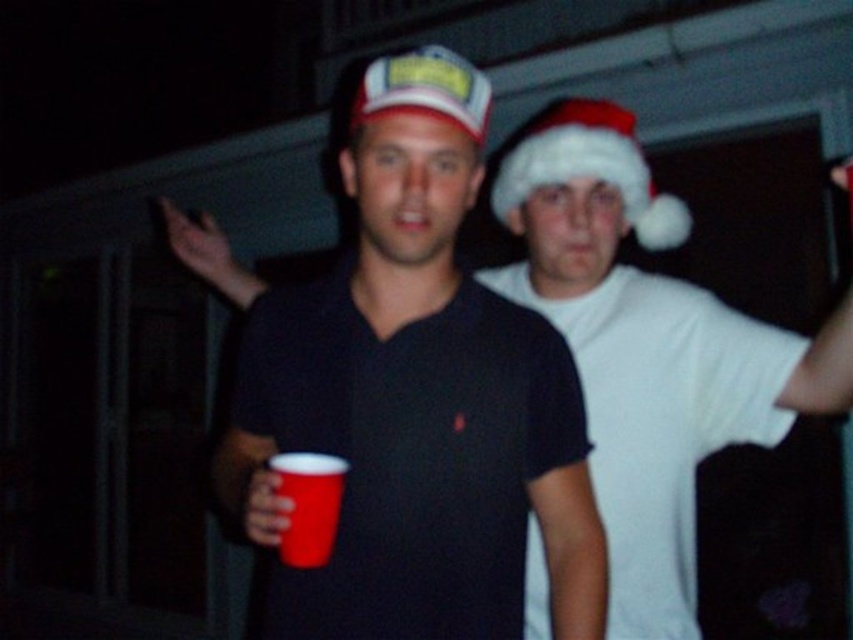
Can you confirm if matte plastic cup at center is thinner than white fluffy santa hat at upper right?

Incorrect, matte plastic cup at center's width is not less than white fluffy santa hat at upper right's.

Is matte plastic cup at center above white fluffy santa hat at upper right?

No.

Does point (395, 80) lie behind point (634, 118)?

No, (395, 80) is closer to viewer.

Where is `matte plastic cup at center`? Image resolution: width=853 pixels, height=640 pixels. matte plastic cup at center is located at coordinates (410, 396).

Does white fluffy santa hat at upper right have a lesser width compared to matte plastic cap at center?

Incorrect, white fluffy santa hat at upper right's width is not less than matte plastic cap at center's.

Does white fluffy santa hat at upper right appear on the right side of matte plastic cap at center?

Yes, white fluffy santa hat at upper right is to the right of matte plastic cap at center.

The image size is (853, 640). In order to click on white fluffy santa hat at upper right in this screenshot , I will do `click(589, 168)`.

The width and height of the screenshot is (853, 640). I want to click on white fluffy santa hat at upper right, so click(589, 168).

Between white fluffy santa hat at upper right and red plastic cup at center, which one appears on the left side from the viewer's perspective?

red plastic cup at center is more to the left.

Is point (642, 168) closer to viewer compared to point (315, 472)?

No, it is behind (315, 472).

Locate an element on the screen. white fluffy santa hat at upper right is located at coordinates (589, 168).